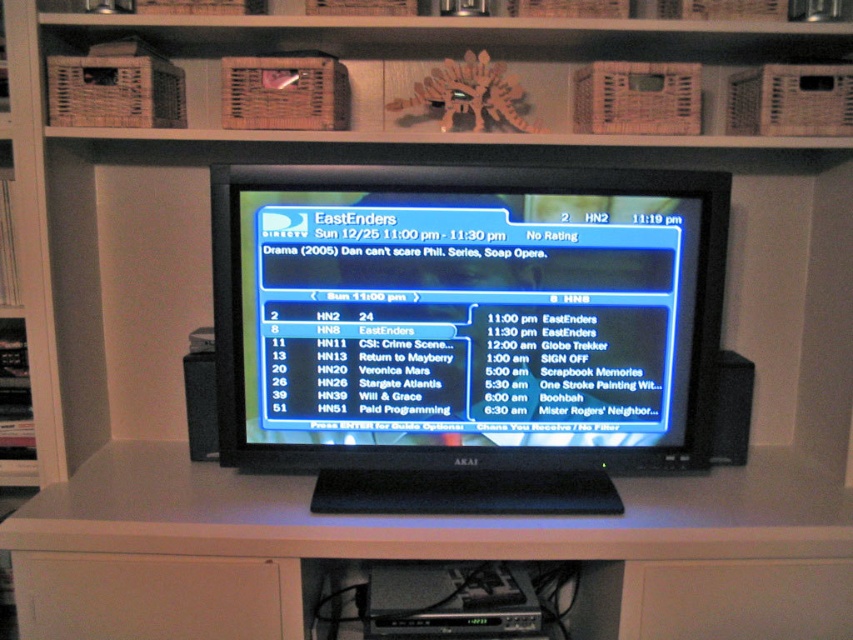
Question: Is matte plastic tv screen at center closer to the viewer compared to black plastic speaker at right?

Choices:
 (A) yes
 (B) no

Answer: (A)

Question: Which of the following is the closest to the observer?

Choices:
 (A) (741, 371)
 (B) (518, 221)

Answer: (B)

Question: Does wooden at upper center have a larger size compared to black plastic speaker at left?

Choices:
 (A) no
 (B) yes

Answer: (B)

Question: Is the position of black plastic speaker at right more distant than that of black plastic speaker at left?

Choices:
 (A) no
 (B) yes

Answer: (A)

Question: Which of the following is the closest to the observer?

Choices:
 (A) (819, 38)
 (B) (347, 422)

Answer: (B)

Question: Based on their relative distances, which object is farther from the wooden at upper center?

Choices:
 (A) black plastic speaker at right
 (B) matte plastic tv screen at center
 (C) black plastic speaker at left

Answer: (C)